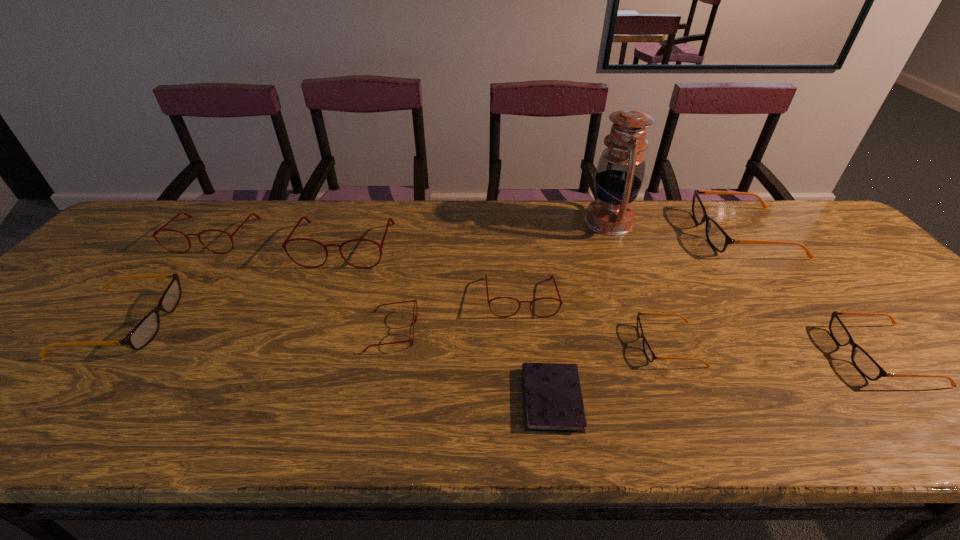
At what (x,y) coordinates should I click in order to perform the action: click on oil lamp. Please return your answer as a coordinate pair (x, y). Image resolution: width=960 pixels, height=540 pixels. Looking at the image, I should click on (620, 171).

This screenshot has height=540, width=960. In order to click on the tallest object in this screenshot , I will do `click(620, 171)`.

The width and height of the screenshot is (960, 540). In order to click on the biggest red spectacles in this screenshot , I will do pyautogui.click(x=287, y=240).

You are a GUI agent. You are given a task and a screenshot of the screen. Output one action in this format:
    pyautogui.click(x=<x>, y=<y>)
    Task: Click on the tallest spectacles
    The width and height of the screenshot is (960, 540).
    Given the screenshot: What is the action you would take?
    pyautogui.click(x=287, y=240)

Image resolution: width=960 pixels, height=540 pixels. I want to click on the leftmost red spectacles, so click(161, 229).

Identify the location of the biggest black spectacles. (717, 237).

Locate an element on the screen. Image resolution: width=960 pixels, height=540 pixels. the fourth spectacles from right to left is located at coordinates (552, 276).

I want to click on the rightmost red spectacles, so click(552, 276).

Identify the location of the leftmost black spectacles. Image resolution: width=960 pixels, height=540 pixels. (148, 327).

Find the location of `the smallest red spectacles`. the smallest red spectacles is located at coordinates (415, 300).